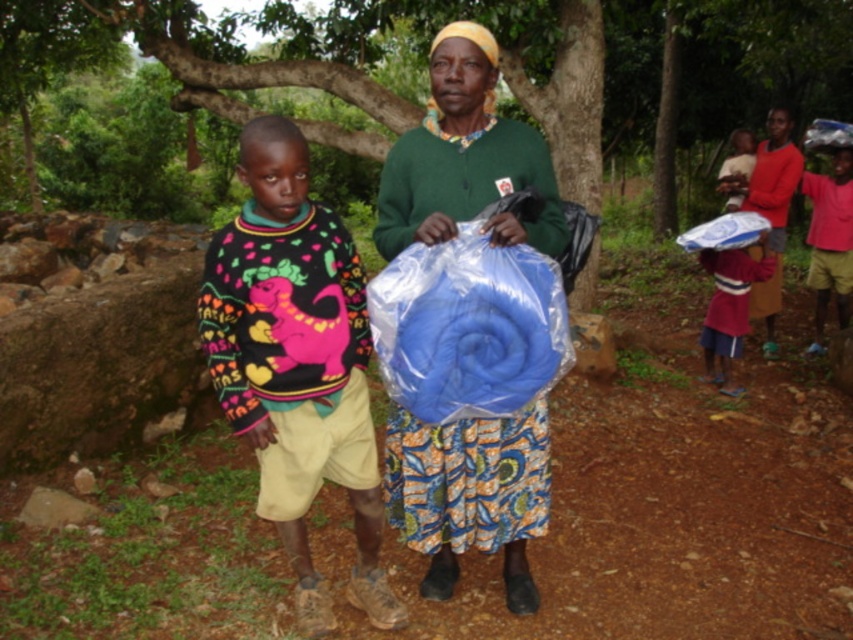
You are a hiker who needs to access the red cotton shirt at lower right to check its condition. Is the matte blue fabric at right blocking your direct path to it?

The matte blue fabric at right is positioned over the red cotton shirt at lower right, so yes, the matte blue fabric at right is blocking the direct path to the red cotton shirt at lower right.

You are standing at the point with coordinates point (711, 307) and want to walk to the point with coordinates point (233, 321). Which direction should you go to reach your destination?

You should walk forward because point (233, 321) is in front of point (711, 307).

Looking at this image, you are planning to pack a small backpack for a short hike and need to choose between the matte green sweater at center and the red cotton shirt at lower right. Based on their sizes, which one do you think will take up more space in your backpack?

The red cotton shirt at lower right occupies more space than the matte green sweater at center, so it will take up more space in the backpack.